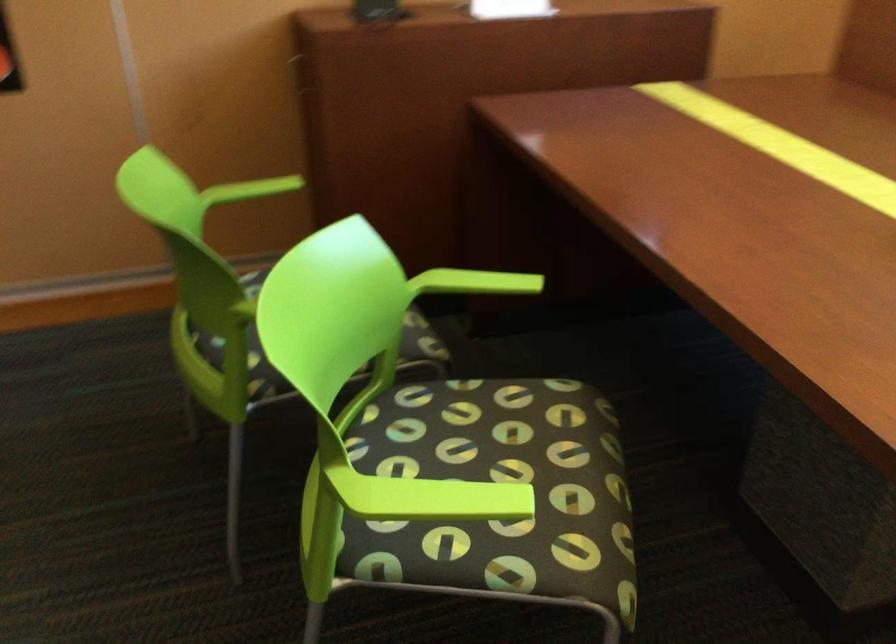
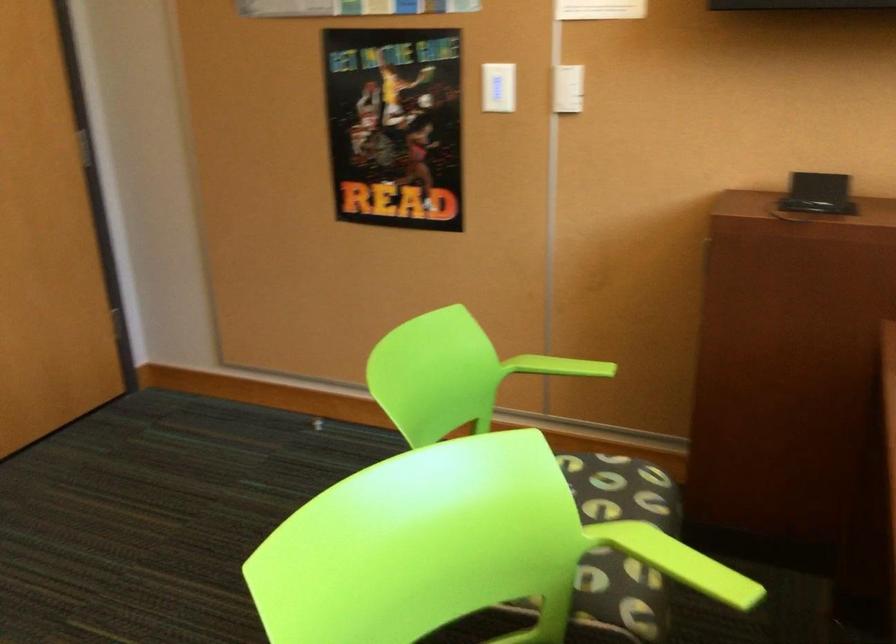
Where in the second image is the point corresponding to pixel 252 190 from the first image?

(558, 366)